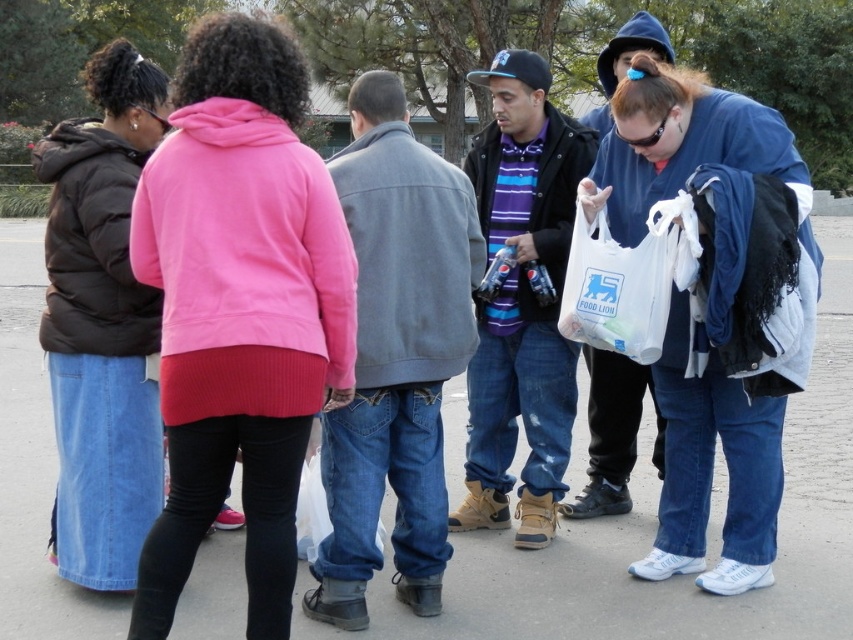
Does striped cotton shirt at center have a lesser height compared to white plastic bag at center?

No, striped cotton shirt at center is not shorter than white plastic bag at center.

Between striped cotton shirt at center and white plastic bag at center, which one is positioned higher?

white plastic bag at center is above.

Image resolution: width=853 pixels, height=640 pixels. I want to click on striped cotton shirt at center, so click(x=521, y=300).

Between point (432, 474) and point (486, 333), which one is positioned in front?

Positioned in front is point (432, 474).

Does denim jeans at center have a larger size compared to striped cotton shirt at center?

Indeed, denim jeans at center has a larger size compared to striped cotton shirt at center.

Between point (447, 541) and point (495, 220), which one is positioned behind?

Positioned behind is point (495, 220).

Find the location of `denim jeans at center`. denim jeans at center is located at coordinates (395, 356).

Does point (448, 548) lie behind point (653, 349)?

Yes.

Can you confirm if denim jeans at center is positioned to the right of white plastic bag at center?

Incorrect, denim jeans at center is not on the right side of white plastic bag at center.

Which is behind, point (454, 300) or point (589, 278)?

Positioned behind is point (589, 278).

Find the location of a particular element. The height and width of the screenshot is (640, 853). denim jeans at center is located at coordinates (395, 356).